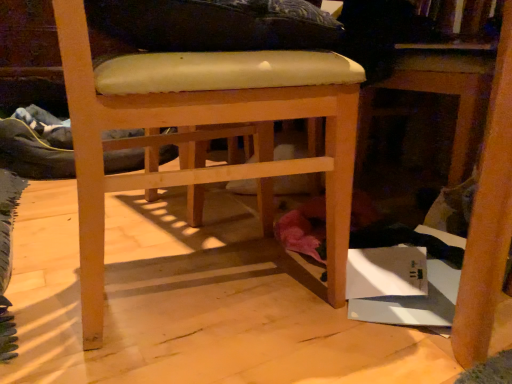
Question: Is wooden table at lower right in front of or behind light brown wood chair at center in the image?

Choices:
 (A) front
 (B) behind

Answer: (B)

Question: Does point (397, 69) appear closer or farther from the camera than point (202, 112)?

Choices:
 (A) farther
 (B) closer

Answer: (A)

Question: Is wooden table at lower right wider or thinner than light brown wood chair at center?

Choices:
 (A) wide
 (B) thin

Answer: (A)

Question: Considering the positions of point (256, 97) and point (406, 64), is point (256, 97) closer or farther from the camera than point (406, 64)?

Choices:
 (A) closer
 (B) farther

Answer: (A)

Question: Looking at the image, does light brown wood chair at center seem bigger or smaller compared to wooden table at lower right?

Choices:
 (A) small
 (B) big

Answer: (B)

Question: Is light brown wood chair at center wider or thinner than wooden table at lower right?

Choices:
 (A) thin
 (B) wide

Answer: (A)

Question: Is light brown wood chair at center in front of or behind wooden table at lower right in the image?

Choices:
 (A) behind
 (B) front

Answer: (B)